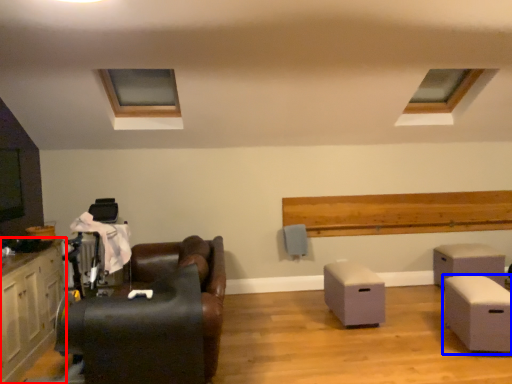
Question: Which object appears farthest to the camera in this image, cabinetry (highlighted by a red box) or table (highlighted by a blue box)?

Choices:
 (A) cabinetry
 (B) table

Answer: (B)